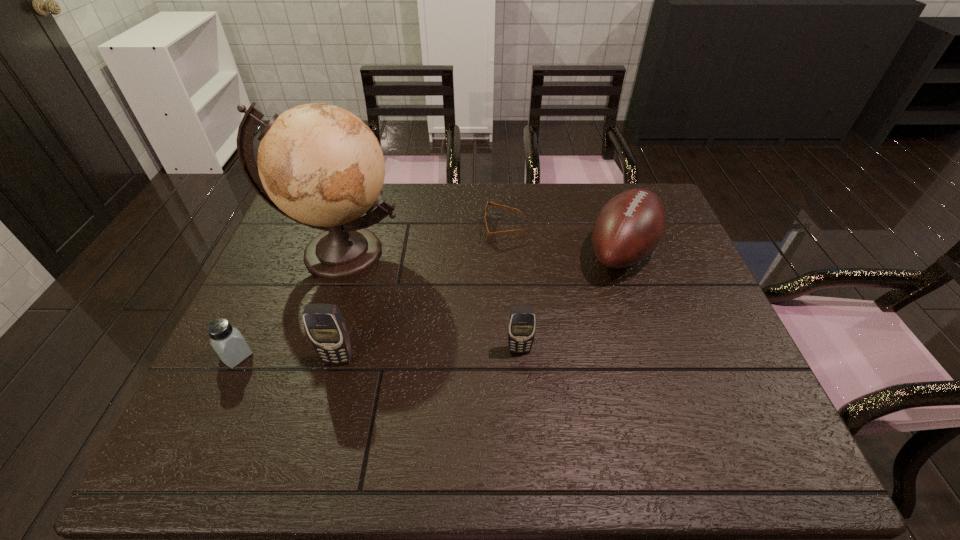
At what (x,y) coordinates should I click in order to perform the action: click on vacant area situated 0.330m on the frames of the sunglasses. Please return your answer as a coordinate pair (x, y). Looking at the image, I should click on (378, 229).

Find the location of a particular element. The height and width of the screenshot is (540, 960). free point located 0.330m on the frames of the sunglasses is located at coordinates (378, 229).

In order to click on free space located 0.240m on the front-facing side of the globe in this screenshot , I will do `click(303, 364)`.

Find the location of a particular element. This screenshot has width=960, height=540. vacant area situated 0.220m on the back of the rightmost object is located at coordinates (598, 183).

You are a GUI agent. You are given a task and a screenshot of the screen. Output one action in this format:
    pyautogui.click(x=<x>, y=<y>)
    Task: Click on the free spot located 0.070m on the front of the saltshaker
    
    Given the screenshot: What is the action you would take?
    pyautogui.click(x=218, y=396)

This screenshot has height=540, width=960. I want to click on sunglasses that is positioned at the far edge, so click(486, 232).

In order to click on globe situated at the far edge in this screenshot , I will do `click(320, 165)`.

This screenshot has width=960, height=540. What are the coordinates of `football (American) located at the far edge` in the screenshot? It's located at (629, 227).

You are a GUI agent. You are given a task and a screenshot of the screen. Output one action in this format:
    pyautogui.click(x=<x>, y=<y>)
    Task: Click on the globe located in the left edge section of the desktop
    
    Given the screenshot: What is the action you would take?
    pyautogui.click(x=320, y=165)

At what (x,y) coordinates should I click in order to perform the action: click on saltshaker positioned at the left edge. Please return your answer as a coordinate pair (x, y). The width and height of the screenshot is (960, 540). Looking at the image, I should click on (227, 341).